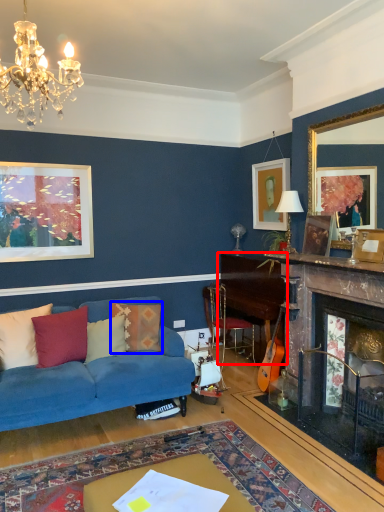
Question: Which object is closer to the camera taking this photo, table (highlighted by a red box) or pillow (highlighted by a blue box)?

Choices:
 (A) table
 (B) pillow

Answer: (B)